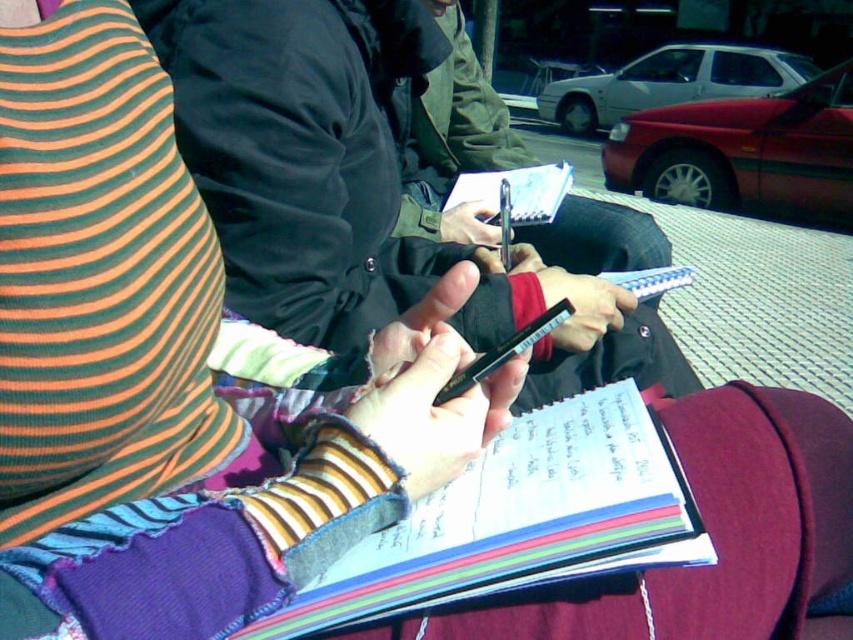
You are trying to locate the multicolored paper notebook at center in the image. According to the coordinates provided in the scene description, where exactly is it positioned?

The multicolored paper notebook at center is located at point (519, 518).

You are trying to determine which object is taller between the black matte jacket at center and the black plastic pen at center. Based on the scene described, which one is taller?

The black matte jacket at center is taller than the black plastic pen at center.

You are a delivery robot with a package that needs to be placed between the multicolored paper notebook at center and the green fabric jacket at center. The package measures 30 inches in length. Will there be enough space to place the package between them?

The distance between the multicolored paper notebook at center and the green fabric jacket at center is 33.60 inches. Since the package is 30 inches long, there is sufficient space to place it between them.